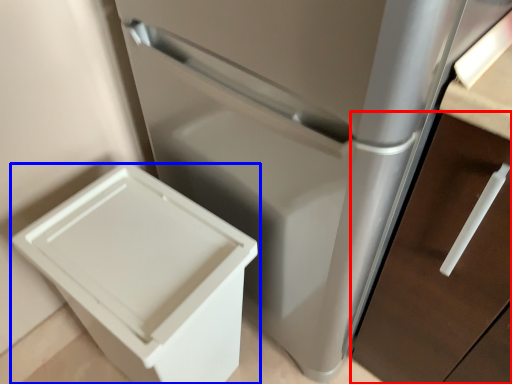
Question: Among these objects, which one is nearest to the camera, drawer (highlighted by a red box) or waste container (highlighted by a blue box)?

Choices:
 (A) drawer
 (B) waste container

Answer: (A)